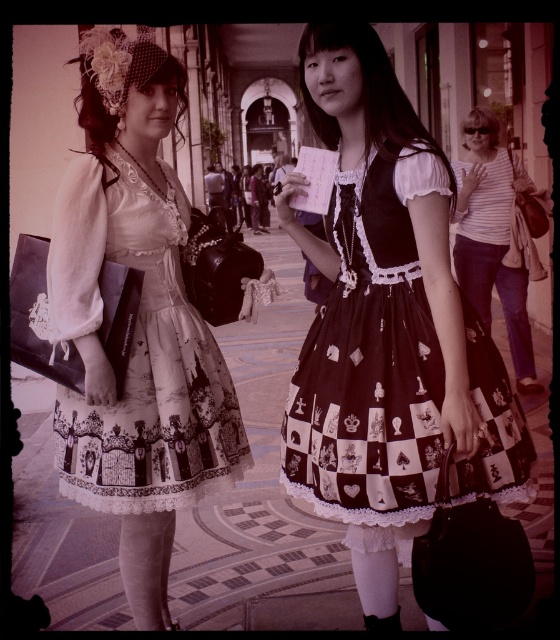
Question: Does black satin dress at center come behind white striped shirt at right?

Choices:
 (A) no
 (B) yes

Answer: (A)

Question: Among these points, which one is farthest from the camera?

Choices:
 (A) coord(511,176)
 (B) coord(382,204)
 (C) coord(151,339)

Answer: (A)

Question: Which point appears closest to the camera in this image?

Choices:
 (A) (127, 241)
 (B) (421, 348)
 (C) (515, 289)

Answer: (B)

Question: Can you confirm if black satin dress at center is thinner than white lace dress at center?

Choices:
 (A) no
 (B) yes

Answer: (A)

Question: From the image, what is the correct spatial relationship of white lace dress at center in relation to white striped shirt at right?

Choices:
 (A) above
 (B) below

Answer: (B)

Question: Which object is positioned closest to the black satin dress at center?

Choices:
 (A) white lace dress at center
 (B) white striped shirt at right

Answer: (A)